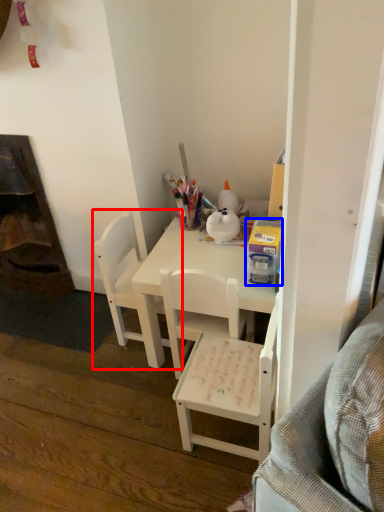
Question: Which object is closer to the camera taking this photo, chair (highlighted by a red box) or box (highlighted by a blue box)?

Choices:
 (A) chair
 (B) box

Answer: (B)